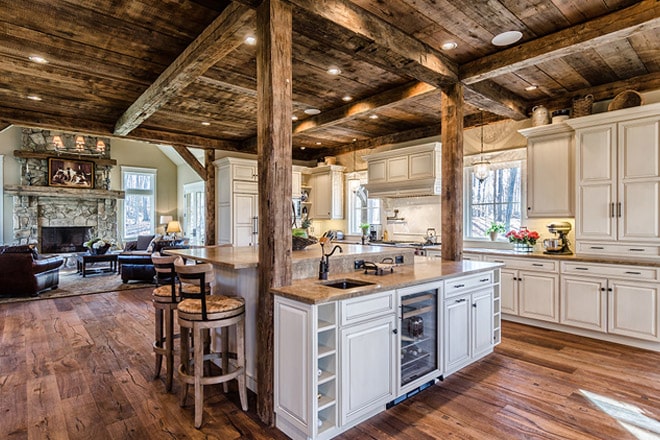
This screenshot has height=440, width=660. I want to click on decorations, so click(525, 235), click(364, 231), click(94, 247), click(78, 178).